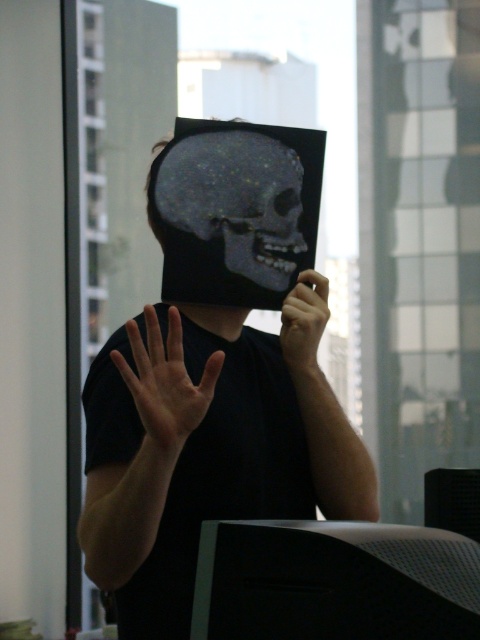
Question: Can you confirm if smooth skin hand at center is positioned above matte black hand at center?

Choices:
 (A) yes
 (B) no

Answer: (B)

Question: Is matte black monitor at center thinner than gray matte skull at center?

Choices:
 (A) yes
 (B) no

Answer: (B)

Question: Among these points, which one is farthest from the camera?

Choices:
 (A) (283, 304)
 (B) (288, 259)
 (C) (165, 246)

Answer: (B)

Question: Which object is positioned farthest from the matte black skull at center?

Choices:
 (A) smooth skin hand at center
 (B) gray matte skull at center

Answer: (A)

Question: Can you confirm if matte black skull at center is wider than gray matte skull at center?

Choices:
 (A) no
 (B) yes

Answer: (B)

Question: Which of the following is the closest to the observer?

Choices:
 (A) (321, 326)
 (B) (200, 211)

Answer: (A)